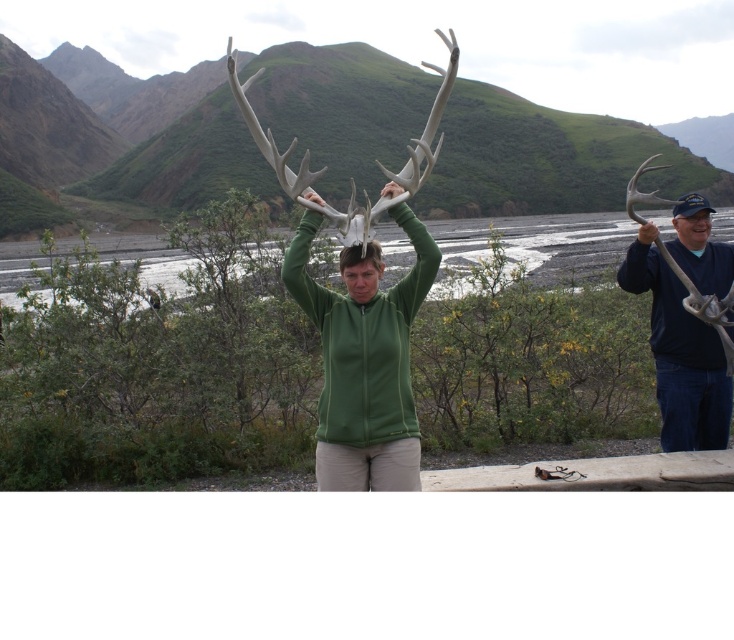
You are a photographer trying to capture both the green matte deer antlers at center and the green matte jacket at center in a single shot. Based on their positions, which object will appear larger in the photo?

The green matte deer antlers at center will appear larger in the photo because they are positioned in front of the green matte jacket at center, making them closer to the camera and thus appear bigger.

You are a wildlife researcher who needs to measure the antlers in the image. You have a ruler that can only measure up to 1 meter. Which of the two antlers, the dark blue fabric antlers at right or the white matte antlers at center, might require a larger measuring tool due to its size?

The white matte antlers at center are larger than the dark blue fabric antlers at right, so the white matte antlers at center might require a larger measuring tool since they exceed the ruler.

In the scene shown: You are a wildlife researcher measuring antler sizes for a study. You have two sets of antlers in front of you, the green matte deer antlers at center and the white matte antlers at center. Which set has a wider spread?

The white matte antlers at center has a wider spread than the green matte deer antlers at center.